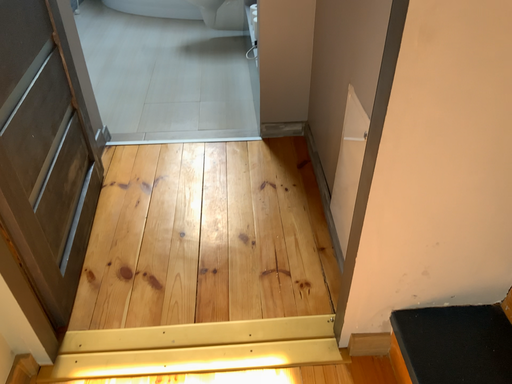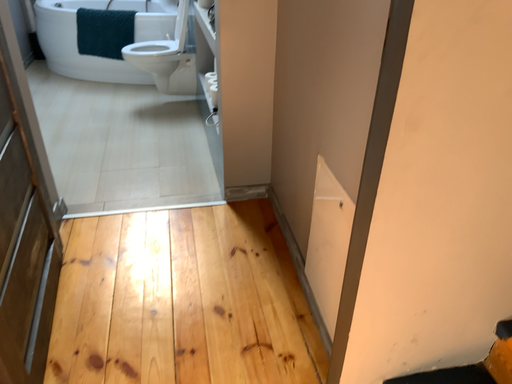
Question: Which way did the camera rotate in the video?

Choices:
 (A) rotated right
 (B) rotated left

Answer: (A)